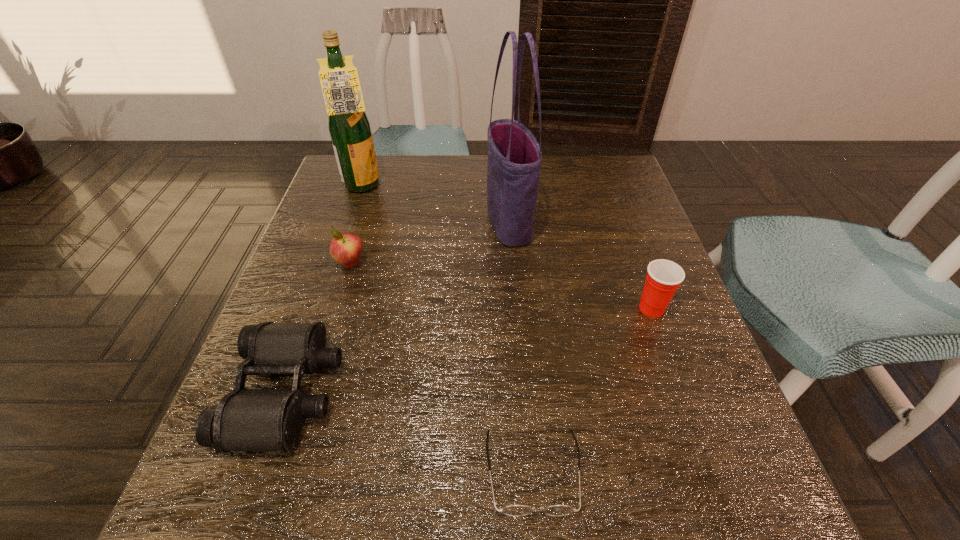
You are a GUI agent. You are given a task and a screenshot of the screen. Output one action in this format:
    pyautogui.click(x=<x>, y=<y>)
    Task: Click on the blank region between the apple and the tote bag
    Image resolution: width=960 pixels, height=540 pixels.
    Given the screenshot: What is the action you would take?
    pyautogui.click(x=430, y=244)

The height and width of the screenshot is (540, 960). I want to click on vacant space in between the tote bag and the liquor, so click(436, 205).

Locate an element on the screen. The width and height of the screenshot is (960, 540). free space between the spectacles and the fourth nearest object is located at coordinates (442, 368).

The height and width of the screenshot is (540, 960). What are the coordinates of `vacant area that lies between the second shortest object and the rightmost object` in the screenshot? It's located at (469, 350).

Where is `vacant area that lies between the liquor and the tote bag`? vacant area that lies between the liquor and the tote bag is located at coordinates (436, 205).

At what (x,y) coordinates should I click in order to perform the action: click on object that is the second closest one to the binoculars. Please return your answer as a coordinate pair (x, y). Looking at the image, I should click on (513, 510).

The image size is (960, 540). Identify the location of the fifth closest object relative to the tote bag. [513, 510].

Image resolution: width=960 pixels, height=540 pixels. Find the location of `vacant point that satisfies the following two spatial constraints: 1. on the front-facing side of the liquor; 2. on the right side of the tote bag`. vacant point that satisfies the following two spatial constraints: 1. on the front-facing side of the liquor; 2. on the right side of the tote bag is located at coordinates (350, 224).

You are a GUI agent. You are given a task and a screenshot of the screen. Output one action in this format:
    pyautogui.click(x=<x>, y=<y>)
    Task: Click on the free space that satisfies the following two spatial constraints: 1. on the front-facing side of the liquor; 2. on the back side of the fourth nearest object
    This screenshot has width=960, height=540.
    Given the screenshot: What is the action you would take?
    pyautogui.click(x=337, y=264)

Identify the location of free space that satisfies the following two spatial constraints: 1. on the front-facing side of the fourth nearest object; 2. on the right side of the liquor. The width and height of the screenshot is (960, 540). (337, 264).